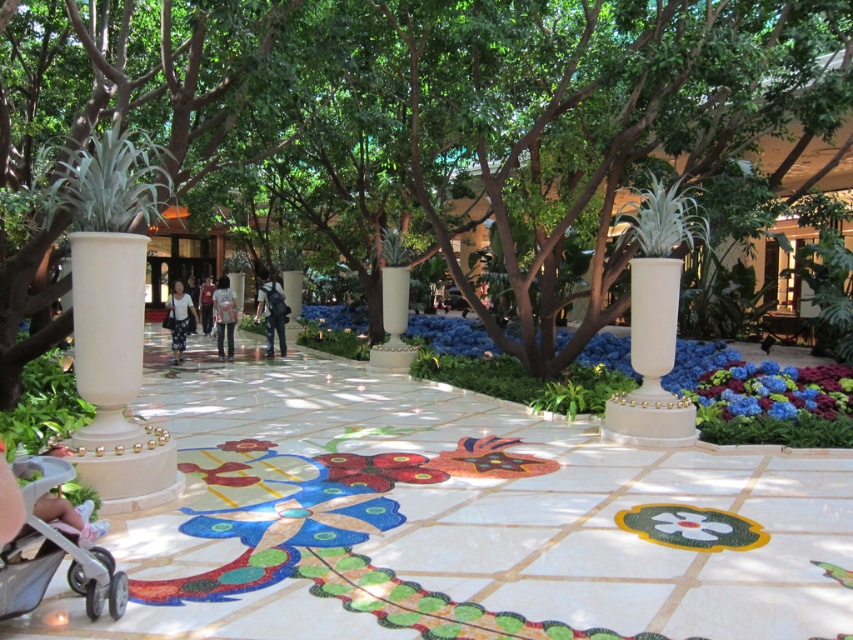
You are a gardener who needs to determine which plant is larger for pruning purposes. Looking at the green leafy tree at center and the blue velvet flowers at center right, which one should you prioritize pruning first based on size?

The green leafy tree at center is bigger than the blue velvet flowers at center right, so you should prioritize pruning the green leafy tree at center first.

You are a guest at the hotel and see both the green leafy tree at center and the light brown leather jacket at center. Which object is taller?

The green leafy tree at center is taller than the light brown leather jacket at center according to the description.